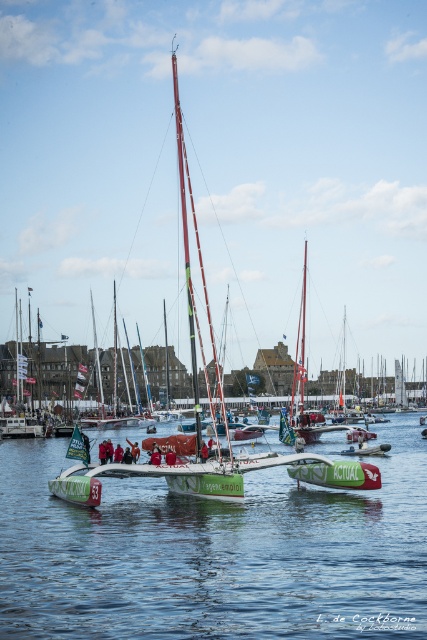
You are a photographer trying to capture the green glossy water at center and the green matte sailboat at center in a single shot. Which object should you place closer to the left side of your camera frame to ensure both are visible?

To ensure both the green glossy water at center and the green matte sailboat at center are visible in your shot, you should position the green glossy water at center on the right side of the camera frame since it is already on the right side of the green matte sailboat at center.

Based on the photo, you are a photographer trying to capture the reflection of the sailboats on the green glossy water at center. Based on the coordinates provided, where should you position your camera to ensure the reflection is centered in your shot?

The green glossy water at center is located at coordinates point [215,554], so positioning the camera at those coordinates will center the reflection of the sailboats on the green glossy water at center.

You are standing on the dock and looking at the green glossy water at center and the green matte sailboat at center. Which object is positioned lower in the image?

The green glossy water at center is positioned below the green matte sailboat at center, so it is lower in the image.